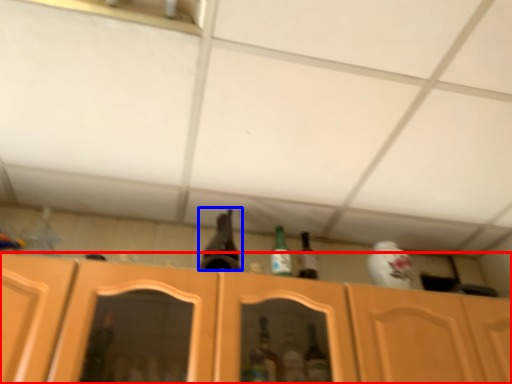
Question: Among these objects, which one is farthest to the camera, cabinetry (highlighted by a red box) or beer bottle (highlighted by a blue box)?

Choices:
 (A) cabinetry
 (B) beer bottle

Answer: (B)